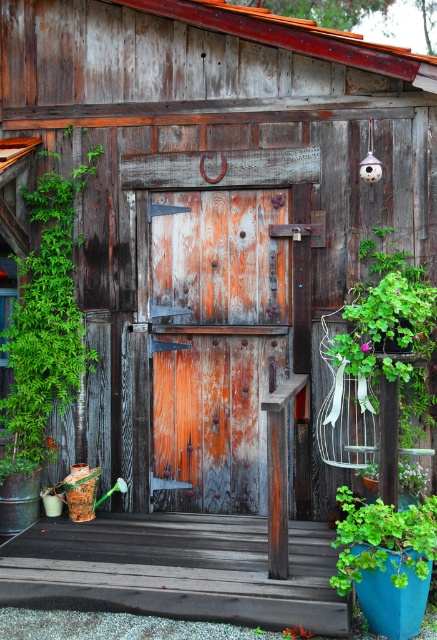
Question: Estimate the real-world distances between objects in this image. Which object is closer to the green leafy plant at right?

Choices:
 (A) weathered wood door at center
 (B) green leafy plant at lower right

Answer: (B)

Question: Does weathered wood door at center appear under green leafy plant at lower right?

Choices:
 (A) no
 (B) yes

Answer: (A)

Question: Is green leafy plant at right positioned in front of green leafy plant at lower right?

Choices:
 (A) yes
 (B) no

Answer: (B)

Question: Estimate the real-world distances between objects in this image. Which object is closer to the green leafy plant at center?

Choices:
 (A) green leafy plant at left
 (B) weathered wood door at center

Answer: (B)

Question: Which object appears farthest from the camera in this image?

Choices:
 (A) green leafy plant at center
 (B) green leafy plant at left

Answer: (B)

Question: Does green leafy plant at left have a lesser width compared to green leafy plant at right?

Choices:
 (A) no
 (B) yes

Answer: (A)